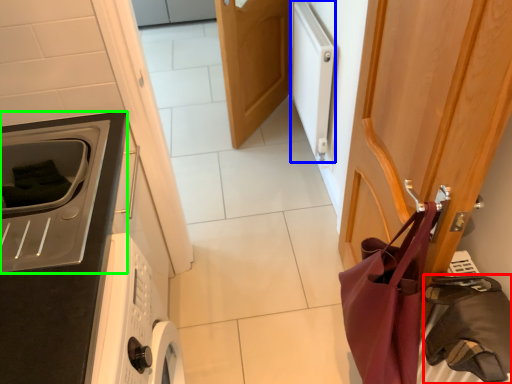
Question: Based on their relative distances, which object is farther from bag (highlighted by a red box)? Choose from appliance (highlighted by a blue box) and home appliance (highlighted by a green box).

Choices:
 (A) appliance
 (B) home appliance

Answer: (A)